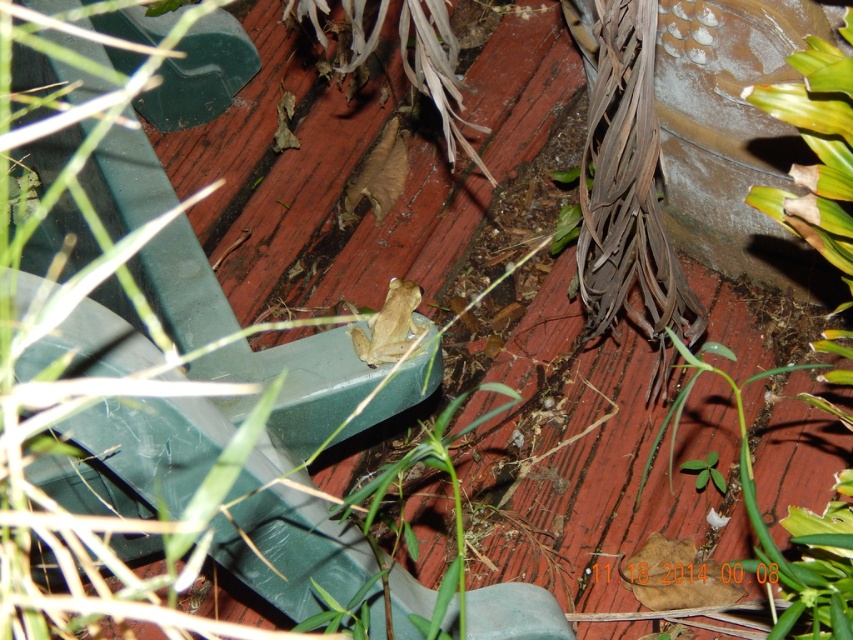
Can you confirm if green leafy plant at lower right is wider than smooth beige frog at center?

Yes, green leafy plant at lower right is wider than smooth beige frog at center.

Can you confirm if green leafy plant at lower right is positioned to the left of smooth beige frog at center?

In fact, green leafy plant at lower right is to the right of smooth beige frog at center.

Is point (827, 349) farther from viewer compared to point (408, 285)?

No, it is not.

Identify the location of green leafy plant at lower right. pos(790,531).